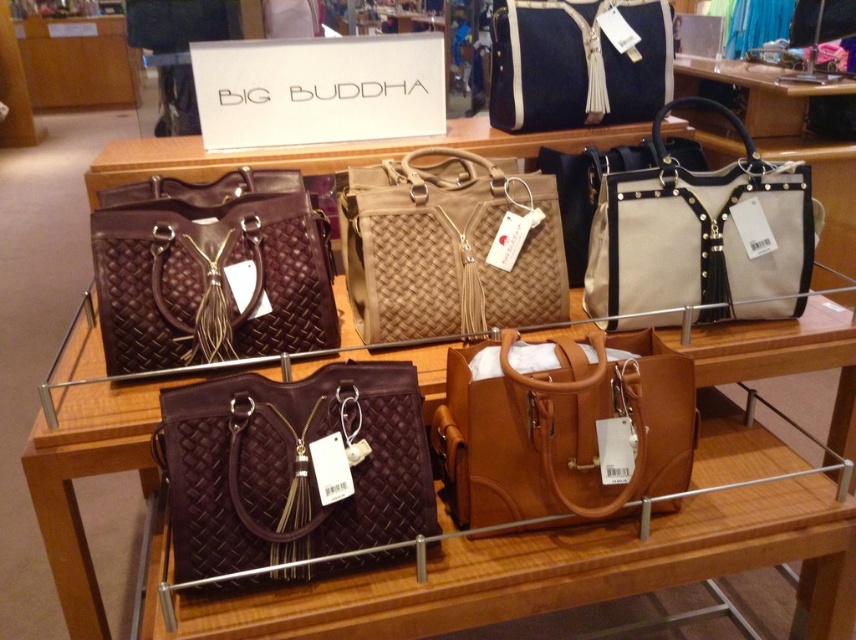
Question: Which object is the farthest from the beige woven handbag at center?

Choices:
 (A) beige canvas tote at upper right
 (B) matte purple woven handbag at lower center
 (C) tan woven handbag at center
 (D) brown woven handbag at upper left

Answer: (B)

Question: Which point is closer to the camera?

Choices:
 (A) (492, 108)
 (B) (195, 202)
 (C) (384, 371)

Answer: (C)

Question: Is black woven handbag at upper center further to camera compared to beige woven handbag at center?

Choices:
 (A) yes
 (B) no

Answer: (A)

Question: Does matte purple woven handbag at lower center lie in front of black woven handbag at upper center?

Choices:
 (A) yes
 (B) no

Answer: (A)

Question: Which is farther from the tan leather handbag at center?

Choices:
 (A) black woven handbag at upper center
 (B) brown woven handbag at upper left
 (C) tan woven handbag at center
 (D) matte purple woven handbag at lower center

Answer: (A)

Question: Does matte leather handbag at center appear on the left side of brown woven handbag at upper left?

Choices:
 (A) no
 (B) yes

Answer: (A)